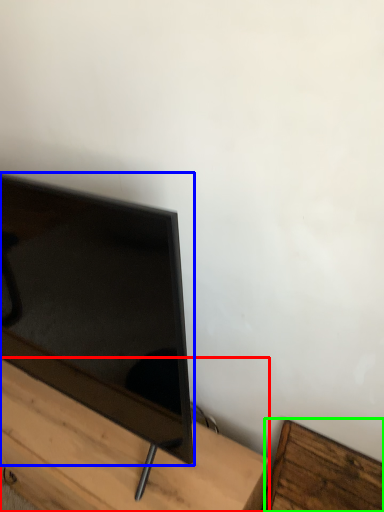
Question: Considering the real-world distances, which object is closest to furniture (highlighted by a red box)? television (highlighted by a blue box) or furniture (highlighted by a green box).

Choices:
 (A) television
 (B) furniture

Answer: (A)